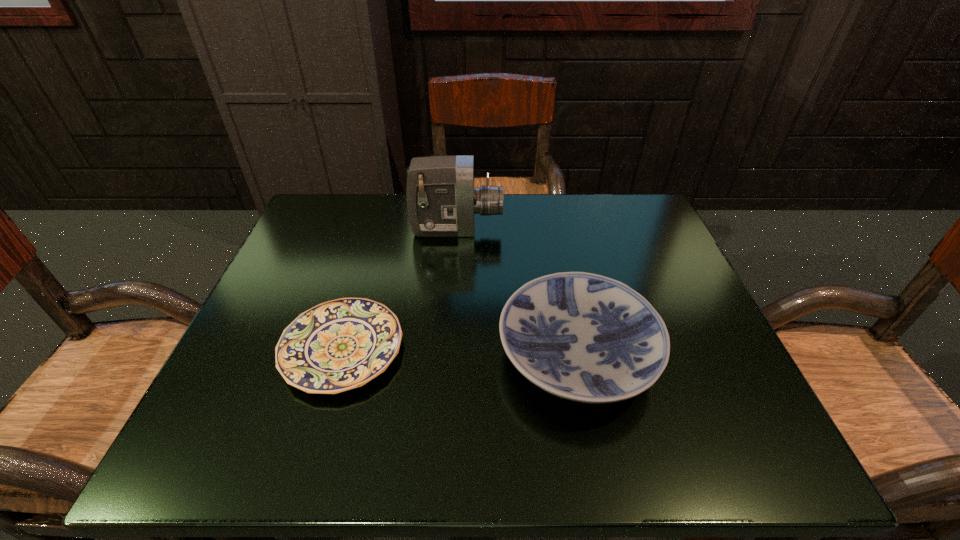
This screenshot has height=540, width=960. Find the location of `object that is positioned at the near edge`. object that is positioned at the near edge is located at coordinates (584, 337).

Locate an element on the screen. Image resolution: width=960 pixels, height=540 pixels. object that is at the left edge is located at coordinates (339, 345).

At what (x,y) coordinates should I click in order to perform the action: click on object positioned at the right edge. Please return your answer as a coordinate pair (x, y). The width and height of the screenshot is (960, 540). Looking at the image, I should click on (584, 337).

You are a GUI agent. You are given a task and a screenshot of the screen. Output one action in this format:
    pyautogui.click(x=<x>, y=<y>)
    Task: Click on the object positioned at the near right corner
    
    Given the screenshot: What is the action you would take?
    pyautogui.click(x=584, y=337)

I want to click on vacant space at the far edge of the desktop, so click(x=408, y=224).

Find the location of `free location at the near edge of the desktop`. free location at the near edge of the desktop is located at coordinates (588, 428).

This screenshot has height=540, width=960. In the image, there is a desktop. Identify the location of blank space at the left edge. (317, 260).

In the image, there is a desktop. In order to click on vacant space at the right edge in this screenshot , I will do `click(641, 276)`.

Image resolution: width=960 pixels, height=540 pixels. In the image, there is a desktop. Identify the location of vacant area at the near left corner. (278, 441).

In order to click on free region at the far right corner of the desktop in this screenshot , I will do `click(620, 204)`.